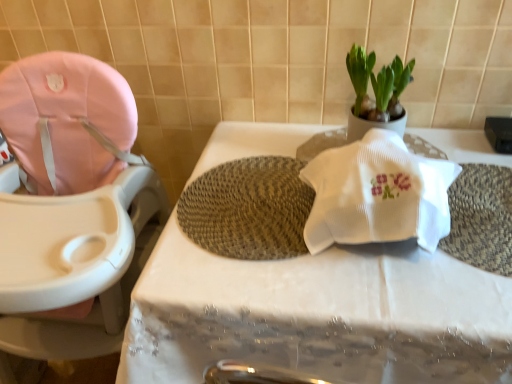
Question: Is white matte pot at upper right at the left side of pink fabric baby carriage at left?

Choices:
 (A) yes
 (B) no

Answer: (B)

Question: From the image's perspective, is white matte pot at upper right over pink fabric baby carriage at left?

Choices:
 (A) no
 (B) yes

Answer: (B)

Question: Is white matte pot at upper right positioned in front of pink fabric baby carriage at left?

Choices:
 (A) no
 (B) yes

Answer: (A)

Question: Considering the relative sizes of white matte pot at upper right and pink fabric baby carriage at left in the image provided, is white matte pot at upper right smaller than pink fabric baby carriage at left?

Choices:
 (A) yes
 (B) no

Answer: (A)

Question: Is white matte pot at upper right positioned beyond the bounds of pink fabric baby carriage at left?

Choices:
 (A) yes
 (B) no

Answer: (A)

Question: Based on their sizes in the image, would you say white fabric table at center is bigger or smaller than pink fabric baby carriage at left?

Choices:
 (A) small
 (B) big

Answer: (B)

Question: Based on their positions, is white fabric table at center located to the left or right of pink fabric baby carriage at left?

Choices:
 (A) left
 (B) right

Answer: (B)

Question: From the image's perspective, is white fabric table at center above or below pink fabric baby carriage at left?

Choices:
 (A) below
 (B) above

Answer: (A)

Question: From a real-world perspective, relative to pink fabric baby carriage at left, is white fabric table at center vertically above or below?

Choices:
 (A) above
 (B) below

Answer: (B)

Question: From a real-world perspective, is pink fabric baby carriage at left physically located above or below white fabric table at center?

Choices:
 (A) below
 (B) above

Answer: (B)

Question: Looking at the image, does pink fabric baby carriage at left seem bigger or smaller compared to white fabric table at center?

Choices:
 (A) big
 (B) small

Answer: (B)

Question: Is pink fabric baby carriage at left inside the boundaries of white fabric table at center, or outside?

Choices:
 (A) outside
 (B) inside

Answer: (A)

Question: From their relative heights in the image, would you say pink fabric baby carriage at left is taller or shorter than white fabric table at center?

Choices:
 (A) short
 (B) tall

Answer: (B)

Question: Is woven beige bath mat at center to the left or to the right of white fabric table at center in the image?

Choices:
 (A) left
 (B) right

Answer: (A)

Question: Is woven beige bath mat at center in front of or behind white fabric table at center in the image?

Choices:
 (A) front
 (B) behind

Answer: (B)